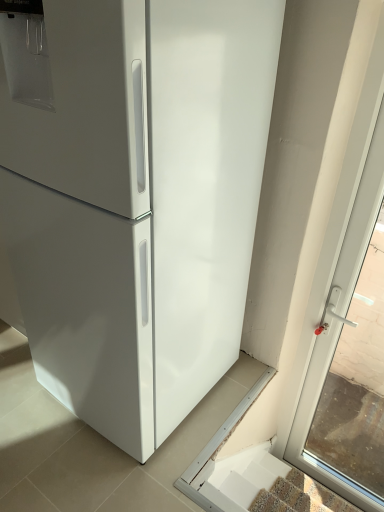
Image resolution: width=384 pixels, height=512 pixels. What do you see at coordinates (267, 486) in the screenshot?
I see `white glossy stairs at lower right` at bounding box center [267, 486].

Find the location of a particular element. The image size is (384, 512). white glossy stairs at lower right is located at coordinates (267, 486).

Measure the distance between white glossy stairs at lower right and camera.

The depth of white glossy stairs at lower right is 4.43 feet.

In order to click on white plastic door handle at right in this screenshot , I will do click(x=357, y=381).

Image resolution: width=384 pixels, height=512 pixels. What do you see at coordinates (357, 381) in the screenshot?
I see `white plastic door handle at right` at bounding box center [357, 381].

Locate an element on the screen. white glossy stairs at lower right is located at coordinates (267, 486).

Between white plastic door handle at right and white glossy stairs at lower right, which one appears on the left side from the viewer's perspective?

white glossy stairs at lower right is more to the left.

In the image, is white plastic door handle at right positioned in front of or behind white glossy stairs at lower right?

Clearly, white plastic door handle at right is in front of white glossy stairs at lower right.

Which point is more distant from viewer, (x=333, y=405) or (x=289, y=487)?

The point (x=333, y=405) is more distant.

From the image's perspective, which one is positioned higher, white plastic door handle at right or white glossy stairs at lower right?

white plastic door handle at right, from the image's perspective.

From a real-world perspective, is white plastic door handle at right under white glossy stairs at lower right?

No, from a real-world perspective, white plastic door handle at right is not under white glossy stairs at lower right.

Considering the sizes of objects white plastic door handle at right and white glossy stairs at lower right in the image provided, who is wider, white plastic door handle at right or white glossy stairs at lower right?

With larger width is white glossy stairs at lower right.

Which of these two, white plastic door handle at right or white glossy stairs at lower right, stands shorter?

Standing shorter between the two is white glossy stairs at lower right.

Who is bigger, white plastic door handle at right or white glossy stairs at lower right?

white plastic door handle at right.

Which is correct: white plastic door handle at right is inside white glossy stairs at lower right, or outside of it?

The correct answer is: outside.

Is white plastic door handle at right positioned far away from white glossy stairs at lower right?

They are positioned close to each other.

Is white plastic door handle at right oriented away from white glossy stairs at lower right?

That's not correct — white plastic door handle at right is not looking away from white glossy stairs at lower right.

What's the angular difference between white plastic door handle at right and white glossy stairs at lower right's facing directions?

180 degrees separate the facing orientations of white plastic door handle at right and white glossy stairs at lower right.

Locate an element on the screen. The image size is (384, 512). window located above the white glossy stairs at lower right (from a real-world perspective) is located at coordinates (357, 381).

Consider the image. Considering the relative positions of white glossy stairs at lower right and white plastic door handle at right in the image provided, is white glossy stairs at lower right to the left of white plastic door handle at right from the viewer's perspective?

Indeed, white glossy stairs at lower right is positioned on the left side of white plastic door handle at right.

Is white glossy stairs at lower right in front of or behind white plastic door handle at right in the image?

white glossy stairs at lower right is positioned farther from the viewer than white plastic door handle at right.

Considering the points (238, 493) and (344, 423), which point is behind, point (238, 493) or point (344, 423)?

The point (344, 423) is more distant.

From the image's perspective, between white glossy stairs at lower right and white plastic door handle at right, which one is located above?

white plastic door handle at right, from the image's perspective.

From a real-world perspective, who is located higher, white glossy stairs at lower right or white plastic door handle at right?

white plastic door handle at right.

Considering the sizes of white glossy stairs at lower right and white plastic door handle at right in the image, is white glossy stairs at lower right wider or thinner than white plastic door handle at right?

Considering their sizes, white glossy stairs at lower right looks broader than white plastic door handle at right.

Does white glossy stairs at lower right have a greater height compared to white plastic door handle at right?

No.

Consider the image. Does white glossy stairs at lower right have a smaller size compared to white plastic door handle at right?

Yes.

Would you say white glossy stairs at lower right is inside or outside white plastic door handle at right?

white glossy stairs at lower right is not inside white plastic door handle at right, it's outside.

Is white glossy stairs at lower right far away from white plastic door handle at right?

That's not correct — white glossy stairs at lower right is a little close to white plastic door handle at right.

Is white glossy stairs at lower right looking in the opposite direction of white plastic door handle at right?

No, white glossy stairs at lower right's orientation is not away from white plastic door handle at right.

How many degrees apart are the facing directions of white glossy stairs at lower right and white plastic door handle at right?

There is a 180-degree angle between the facing directions of white glossy stairs at lower right and white plastic door handle at right.

You are a GUI agent. You are given a task and a screenshot of the screen. Output one action in this format:
    pyautogui.click(x=<x>, y=<y>)
    Task: Click on the window above the white glossy stairs at lower right (from the image's perspective)
    The height and width of the screenshot is (512, 384).
    Given the screenshot: What is the action you would take?
    pyautogui.click(x=357, y=381)

Identify the location of stairs located on the left of white plastic door handle at right. (267, 486).

Locate an element on the screen. The image size is (384, 512). stairs below the white plastic door handle at right (from the image's perspective) is located at coordinates click(x=267, y=486).